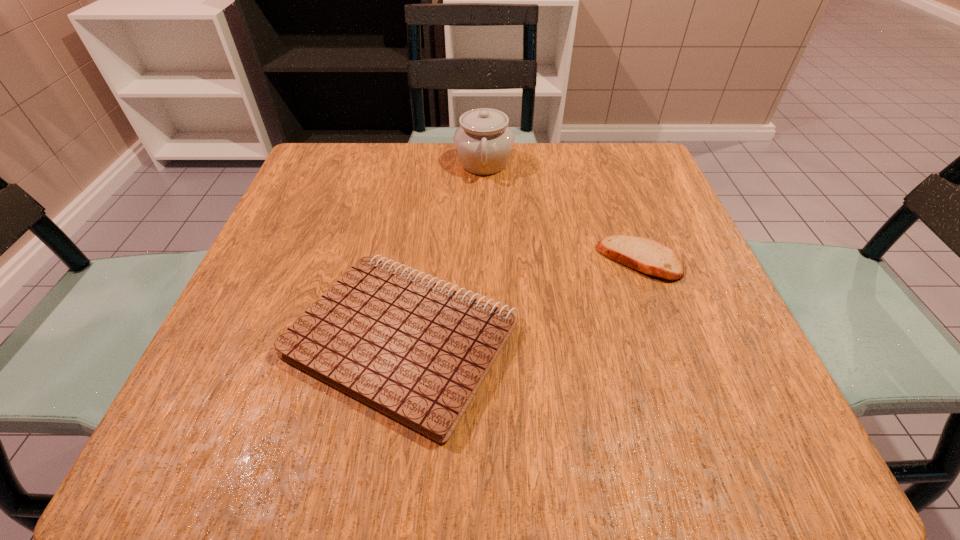
At what (x,y) coordinates should I click in order to perform the action: click on object that is at the left edge. Please return your answer as a coordinate pair (x, y). Looking at the image, I should click on (417, 351).

Identify the location of object that is at the right edge. The image size is (960, 540). (645, 255).

Identify the location of object that is at the near left corner. (417, 351).

At what (x,y) coordinates should I click in order to perform the action: click on free location at the far edge of the desktop. Please return your answer as a coordinate pair (x, y). Looking at the image, I should click on (430, 143).

In the image, there is a desktop. Where is `vacant space at the near edge`? vacant space at the near edge is located at coordinates (339, 422).

In the image, there is a desktop. In order to click on vacant space at the left edge in this screenshot , I will do `click(302, 378)`.

Locate an element on the screen. The height and width of the screenshot is (540, 960). free spot at the right edge of the desktop is located at coordinates (656, 206).

The image size is (960, 540). In the image, there is a desktop. Find the location of `vacant space at the far left corner`. vacant space at the far left corner is located at coordinates (360, 187).

Where is `free region at the far right corner`? free region at the far right corner is located at coordinates (608, 169).

Locate an element on the screen. empty location between the farthest object and the notebook is located at coordinates (443, 251).